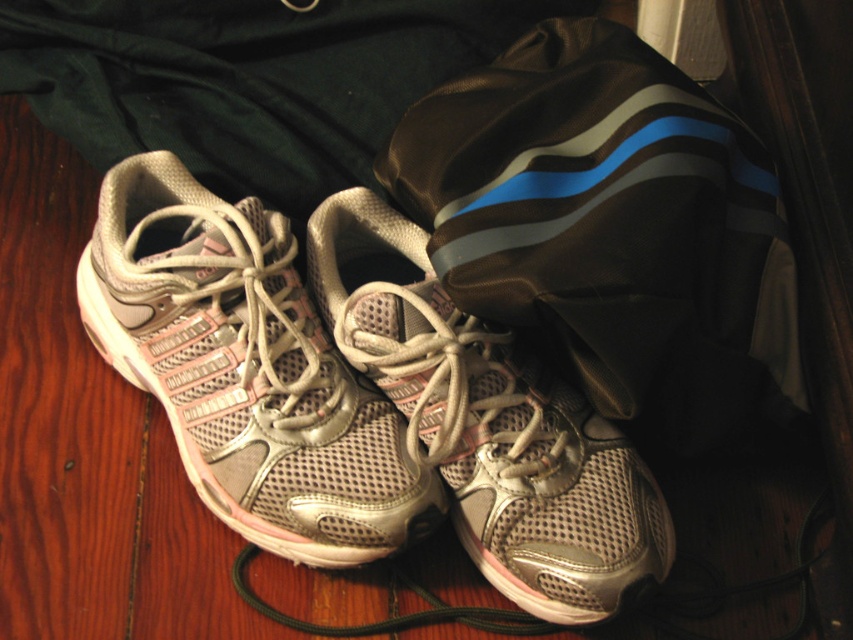
You have a small item that is 6 inches long that you need to place between the brown fabric bag at center and the metallic mesh shoe at center. Can it fit without overlapping either object?

The distance between the brown fabric bag at center and the metallic mesh shoe at center is 6.71 inches. Since the item is 6 inches long, it can fit between them without overlapping either object.

You are standing in front of the silver mesh running shoe at center and the metallic mesh shoe at center. Which one is closer to you?

The silver mesh running shoe at center is closer to you because it is positioned further to the viewer than the metallic mesh shoe at center.

You are trying to place the brown fabric bag at center and the silver mesh running shoe at center into a rectangular box. The box has a width of 15 cm. Which object might not fit if placed individually?

The brown fabric bag at center might not fit into the box if placed individually because it might be wider than the silver mesh running shoe at center, which could fit within the 15 cm width.